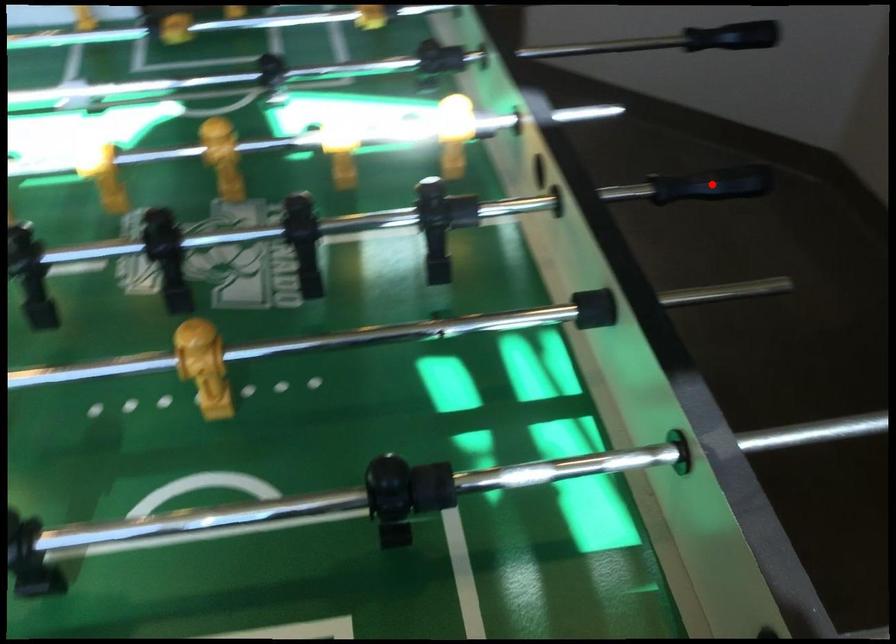
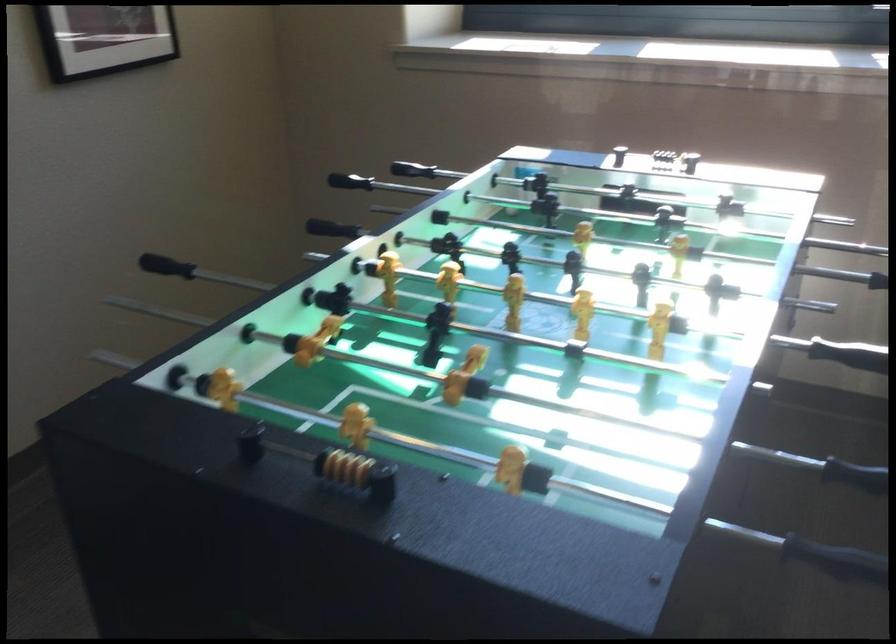
Where in the second image is the point corresponding to the highlighted location from the first image?

(304, 236)